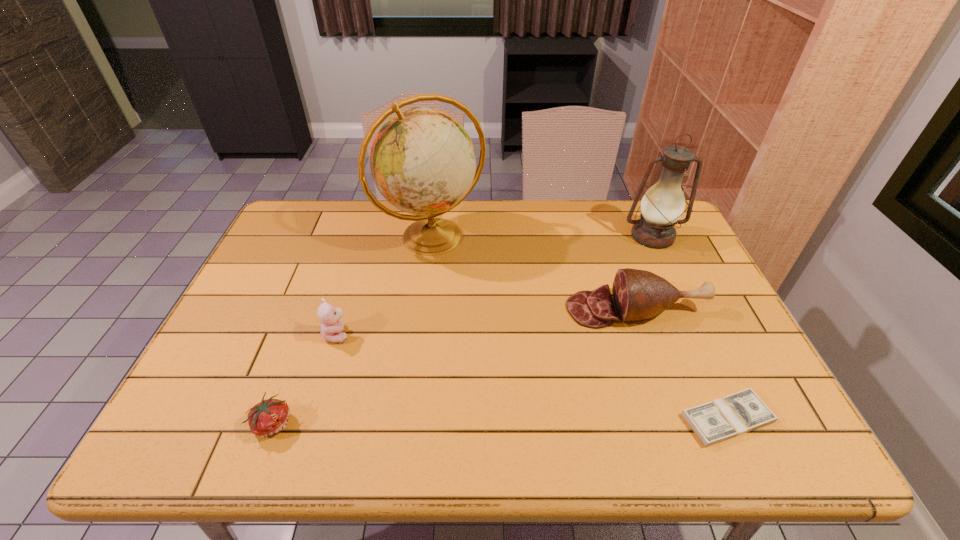
The image size is (960, 540). I want to click on oil lamp that is positioned at the right edge, so click(x=663, y=204).

The image size is (960, 540). I want to click on ham that is at the right edge, so click(638, 294).

Where is `dollar present at the right edge`? Image resolution: width=960 pixels, height=540 pixels. dollar present at the right edge is located at coordinates (736, 414).

Find the location of a particular element. Image resolution: width=960 pixels, height=540 pixels. object that is at the far right corner is located at coordinates (663, 204).

At what (x,y) coordinates should I click in order to perform the action: click on object that is at the near right corner. Please return your answer as a coordinate pair (x, y). The height and width of the screenshot is (540, 960). Looking at the image, I should click on (736, 414).

The width and height of the screenshot is (960, 540). I want to click on free space at the far edge of the desktop, so click(x=488, y=222).

Where is `free space at the near edge of the desktop`? free space at the near edge of the desktop is located at coordinates (649, 453).

Where is `free point at the left edge`? The image size is (960, 540). free point at the left edge is located at coordinates (304, 255).

Identify the location of free region at the right edge of the desktop. (660, 270).

Find the location of a particular element. The height and width of the screenshot is (540, 960). vacant area between the shortest object and the fourth object from right to left is located at coordinates (580, 328).